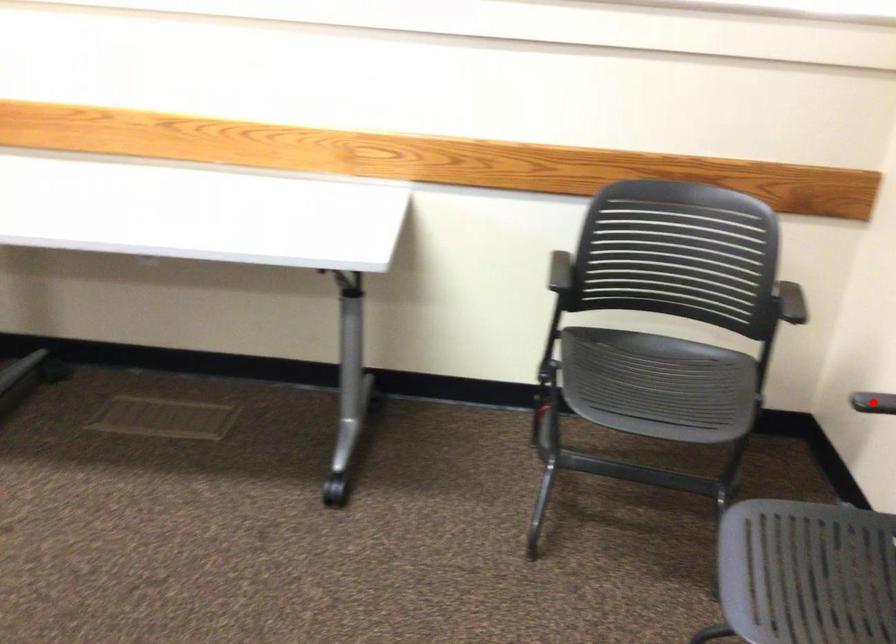
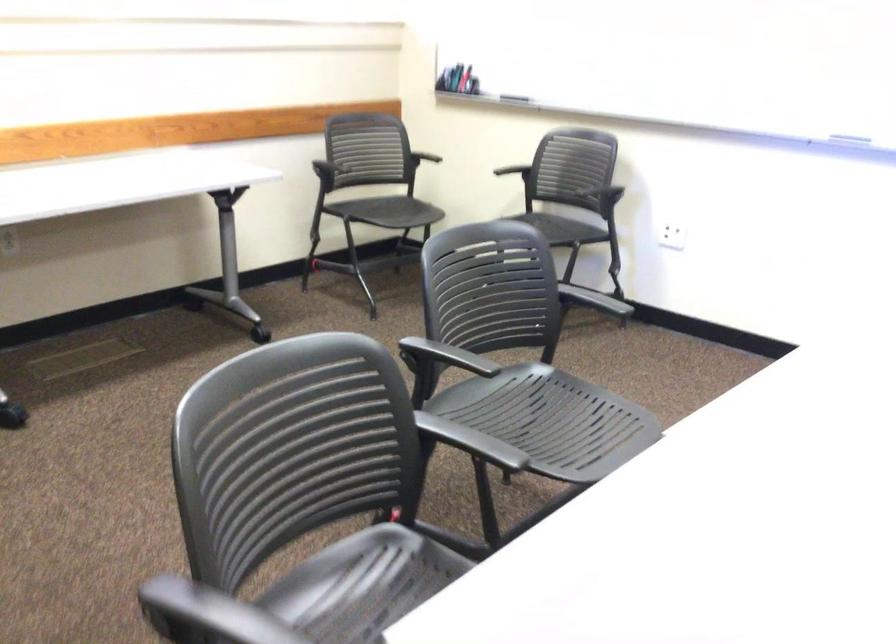
Question: A red point is marked in image1. In image2, is the corresponding 3D point closer to the camera or farther? Reply with the corresponding letter.

Choices:
 (A) The corresponding 3D point is closer.
 (B) The corresponding 3D point is farther.

Answer: (B)